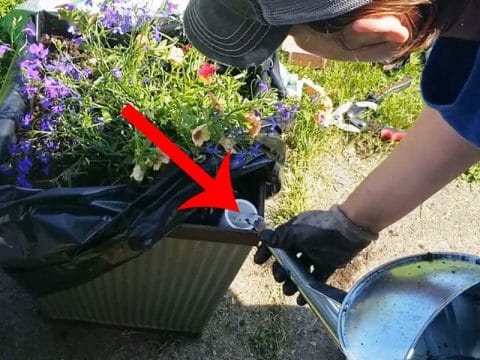
At what (x,y) coordinates should I click in order to perform the action: click on varied flowers. Please return your answer as a coordinate pair (x, y). Looking at the image, I should click on (49, 92), (201, 77), (250, 122).